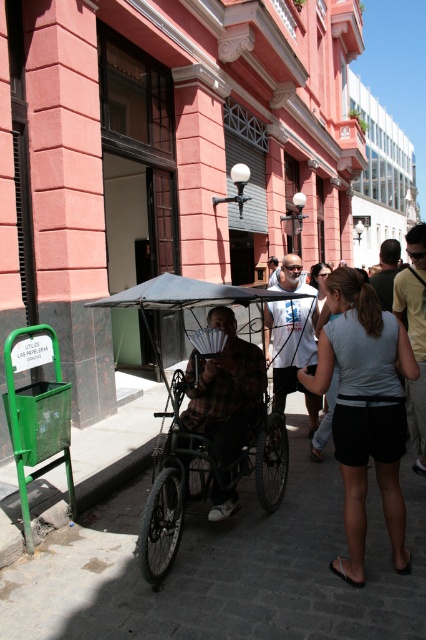
Question: Estimate the real-world distances between objects in this image. Which object is closer to the gray fabric coach at center?

Choices:
 (A) dark gray cobblestone pavement at center
 (B) light gray fabric shirt at center

Answer: (B)

Question: Which is nearer to the white plastic coach at center?

Choices:
 (A) dark gray cobblestone pavement at center
 (B) black matte wheelchair at center
 (C) plaid fabric cart at center
 (D) brown leather coach at center

Answer: (D)

Question: Which of the following is the farthest from the observer?

Choices:
 (A) light gray fabric shirt at center
 (B) dark gray cobblestone pavement at center
 (C) plaid fabric cart at center

Answer: (C)

Question: Can you confirm if light gray fabric shirt at center is positioned to the right of plaid fabric cart at center?

Choices:
 (A) yes
 (B) no

Answer: (A)

Question: Considering the relative positions of dark gray cobblestone pavement at center and black matte wheelchair at center in the image provided, where is dark gray cobblestone pavement at center located with respect to black matte wheelchair at center?

Choices:
 (A) right
 (B) left

Answer: (A)

Question: Is dark gray cobblestone pavement at center to the left of gray fabric coach at center from the viewer's perspective?

Choices:
 (A) yes
 (B) no

Answer: (A)